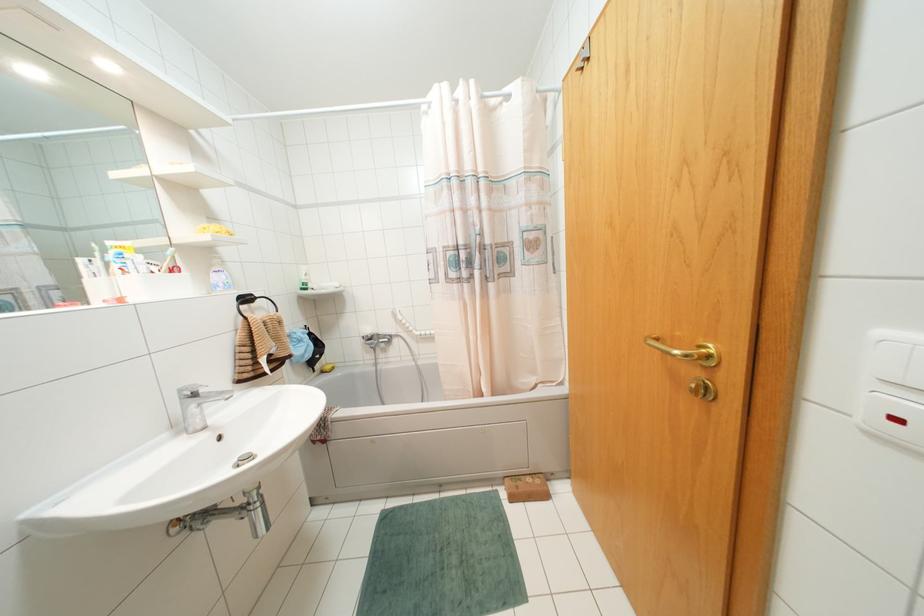
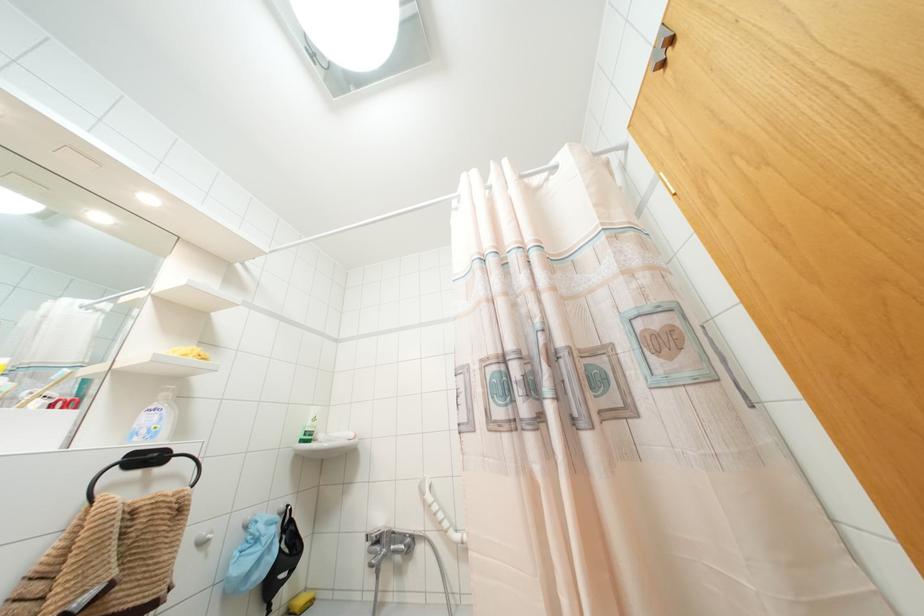
Locate, in the second image, the point that corresponds to (223,276) in the first image.

(154, 418)